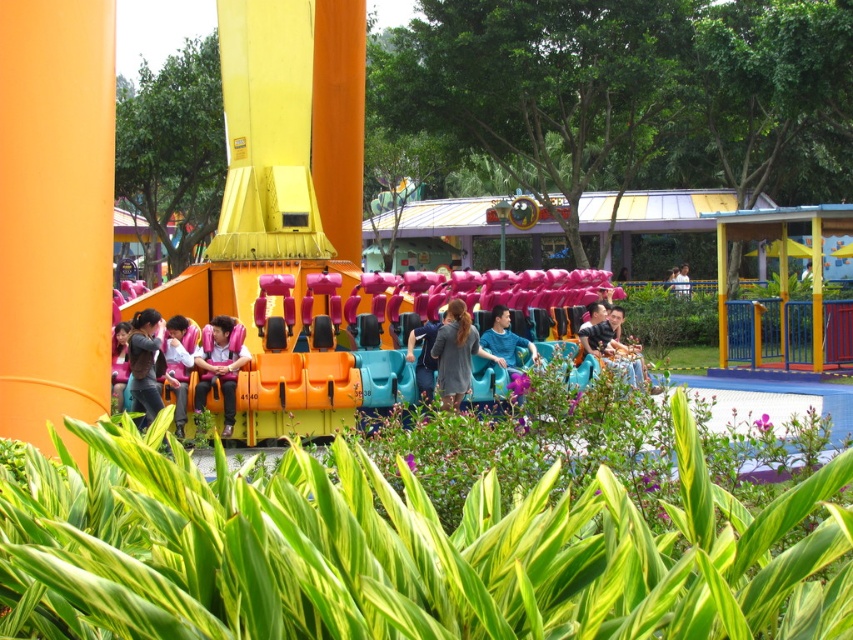
Which is above, matte blue shirt at center or blue denim jeans at center?

matte blue shirt at center is higher up.

Who is more forward, [592,349] or [432,356]?

Positioned in front is point [432,356].

In the scene shown: Who is more distant from viewer, (596, 348) or (415, 328)?

Positioned behind is point (596, 348).

You are a GUI agent. You are given a task and a screenshot of the screen. Output one action in this format:
    pyautogui.click(x=<x>, y=<y>)
    Task: Click on the matte blue shirt at center
    Image resolution: width=853 pixels, height=640 pixels.
    Given the screenshot: What is the action you would take?
    click(614, 348)

Does point (357, 513) come closer to viewer compared to point (212, 380)?

Yes, point (357, 513) is closer to viewer.

Does green leafy plants at lower center have a lesser height compared to matte orange seat at center?

Indeed, green leafy plants at lower center has a lesser height compared to matte orange seat at center.

Is point (361, 545) farther from viewer compared to point (219, 333)?

No, (361, 545) is closer to viewer.

Locate an element on the screen. Image resolution: width=853 pixels, height=640 pixels. green leafy plants at lower center is located at coordinates (404, 552).

Is point (207, 385) closer to viewer compared to point (605, 360)?

Yes, point (207, 385) is closer to viewer.

Does matte orange seat at center lie behind matte blue shirt at center?

No.

Who is more forward, (x=230, y=323) or (x=648, y=387)?

Point (x=648, y=387) is more forward.

I want to click on matte orange seat at center, so click(x=219, y=369).